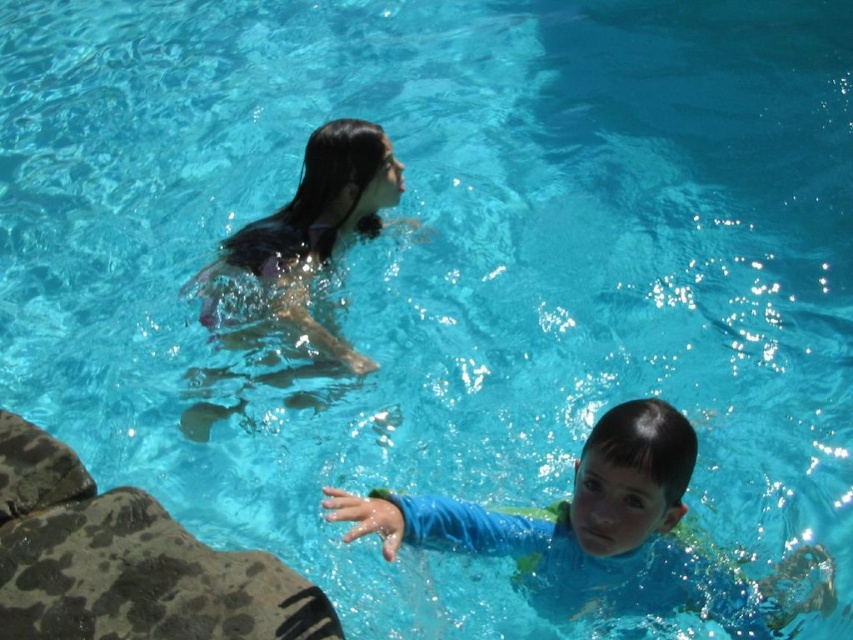
You are a photographer trying to capture the perfect shot of the blue rubber swim suit at center and the wet hair at upper center. Which object should you focus on first if you want to ensure both are in sharp focus, given that your camera can only focus on one point at a time?

You should focus on the wet hair at upper center first because the blue rubber swim suit at center is to the right of it, so focusing on the closer object will ensure both are in focus.

You are standing at the edge of the pool and see the blue rubber swim suit at center and the wet hair at upper center. Which object would you need to look closer at to see details?

The blue rubber swim suit at center is closer to the viewer than the wet hair at upper center, so you would need to look closer at the wet hair at upper center to see its details.